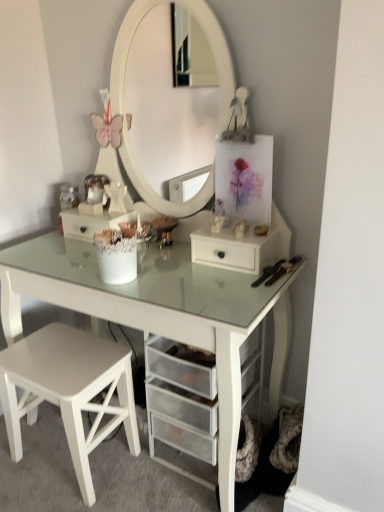
The width and height of the screenshot is (384, 512). Find the location of `free point above white mesh drawer at center (from a real-world perspective)`. free point above white mesh drawer at center (from a real-world perspective) is located at coordinates (93, 206).